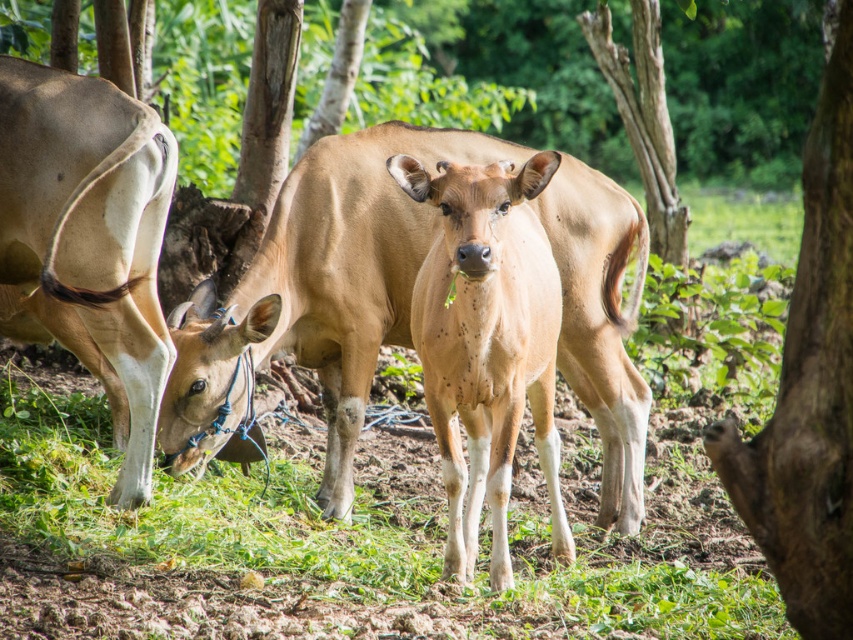
Question: Is green grass at center further to the viewer compared to brown rough bark tree at right?

Choices:
 (A) no
 (B) yes

Answer: (B)

Question: Can you confirm if light brown smooth calf at center is smaller than brown rough bark tree at right?

Choices:
 (A) yes
 (B) no

Answer: (B)

Question: Which of the following is the farthest from the observer?

Choices:
 (A) light brown smooth calf at center
 (B) light brown leather cow at left
 (C) green grass at center
 (D) brown rough bark tree at right

Answer: (B)

Question: Which object is the farthest from the brown rough bark tree at right?

Choices:
 (A) light brown smooth calf at center
 (B) light brown leather cow at left

Answer: (B)

Question: Does light brown leather cow at left appear under brown rough bark tree at right?

Choices:
 (A) no
 (B) yes

Answer: (B)

Question: Which point is closer to the camera?

Choices:
 (A) light brown leather cow at left
 (B) green grass at center

Answer: (B)